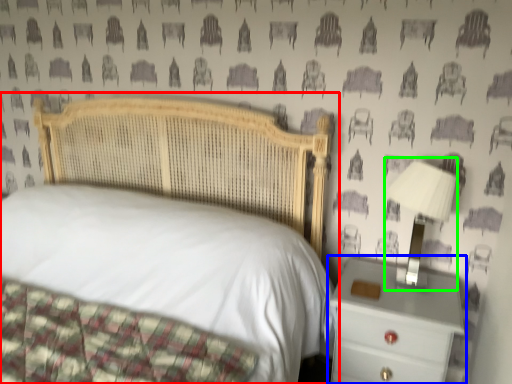
Question: Which object is positioned closest to bed (highlighted by a red box)? Select from nightstand (highlighted by a blue box) and bedside lamp (highlighted by a green box).

Choices:
 (A) nightstand
 (B) bedside lamp

Answer: (A)